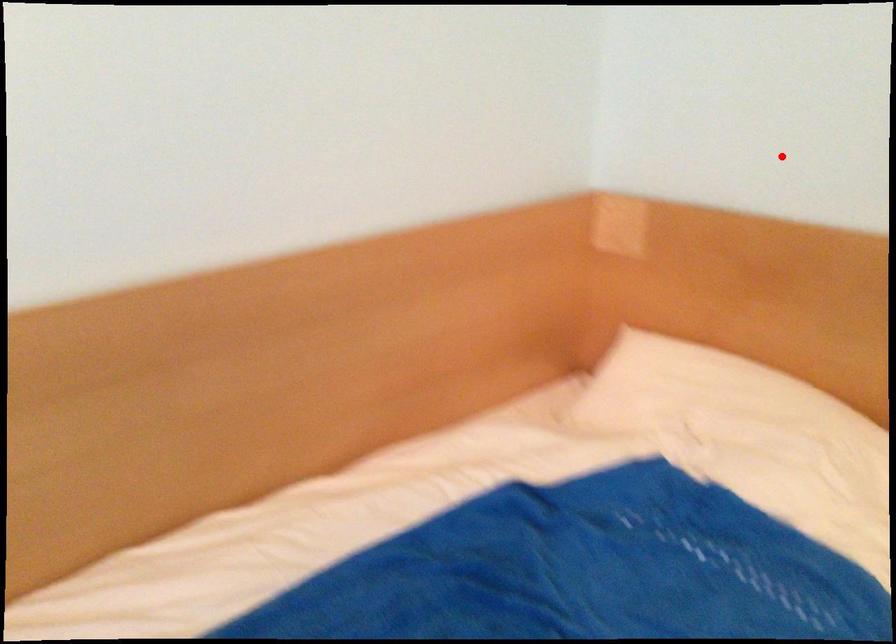
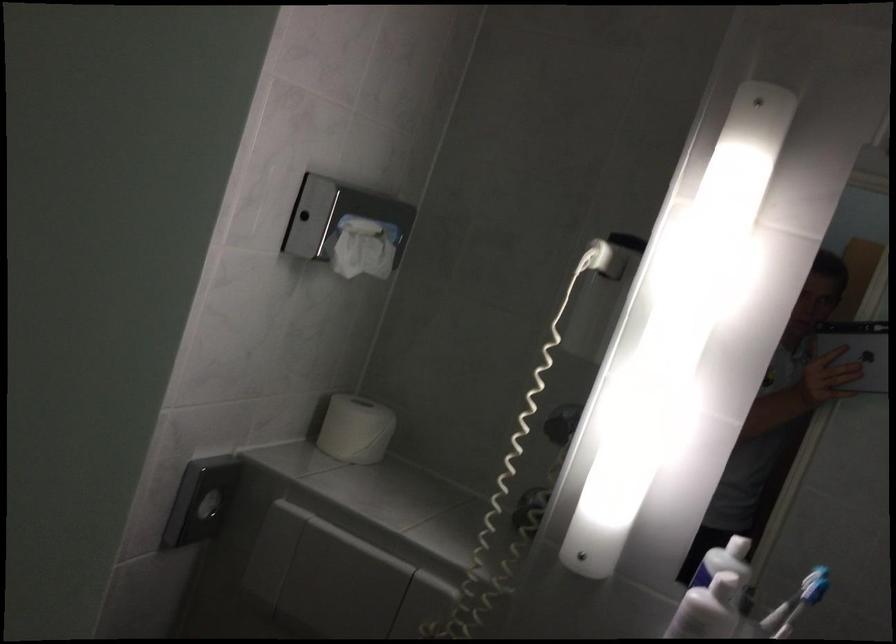
Question: I am providing you with two images of the same scene from different viewpoints. A red point is shown in image1. For the corresponding object point in image2, is it positioned nearer or farther from the camera?

Choices:
 (A) Nearer
 (B) Farther

Answer: (A)